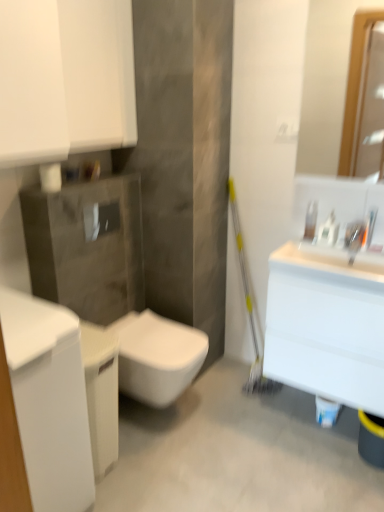
Question: Is white glossy bottle at upper right oriented towards white glossy cabinet at left?

Choices:
 (A) no
 (B) yes

Answer: (A)

Question: Considering the relative sizes of white glossy bottle at upper right and white glossy cabinet at left in the image provided, is white glossy bottle at upper right thinner than white glossy cabinet at left?

Choices:
 (A) yes
 (B) no

Answer: (A)

Question: Are white glossy bottle at upper right and white glossy cabinet at left beside each other?

Choices:
 (A) yes
 (B) no

Answer: (B)

Question: Does white glossy bottle at upper right have a lesser height compared to white glossy cabinet at left?

Choices:
 (A) yes
 (B) no

Answer: (A)

Question: Is white glossy bottle at upper right wider than white glossy cabinet at left?

Choices:
 (A) no
 (B) yes

Answer: (A)

Question: Considering the positions of point (334, 224) and point (46, 409), is point (334, 224) closer or farther from the camera than point (46, 409)?

Choices:
 (A) farther
 (B) closer

Answer: (A)

Question: Is white glossy bottle at upper right bigger or smaller than white glossy cabinet at left?

Choices:
 (A) small
 (B) big

Answer: (A)

Question: Relative to white glossy cabinet at left, is white glossy bottle at upper right in front or behind?

Choices:
 (A) front
 (B) behind

Answer: (B)

Question: From their relative heights in the image, would you say white glossy bottle at upper right is taller or shorter than white glossy cabinet at left?

Choices:
 (A) short
 (B) tall

Answer: (A)

Question: In the image, is white glossy cabinet at left on the left side or the right side of white glossy sink at upper right?

Choices:
 (A) left
 (B) right

Answer: (A)

Question: In the image, is white glossy cabinet at left positioned in front of or behind white glossy sink at upper right?

Choices:
 (A) front
 (B) behind

Answer: (A)

Question: From a real-world perspective, is white glossy cabinet at left above or below white glossy sink at upper right?

Choices:
 (A) below
 (B) above

Answer: (A)

Question: Is white glossy cabinet at left inside the boundaries of white glossy sink at upper right, or outside?

Choices:
 (A) outside
 (B) inside

Answer: (A)

Question: From the image's perspective, is white glossy toilet at center positioned above or below clear plastic soap dispenser at upper right?

Choices:
 (A) above
 (B) below

Answer: (B)

Question: Is white glossy toilet at center bigger or smaller than clear plastic soap dispenser at upper right?

Choices:
 (A) big
 (B) small

Answer: (A)